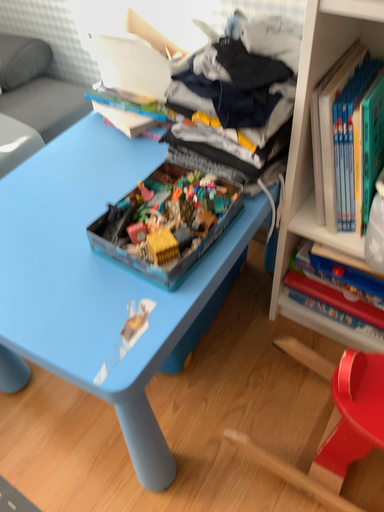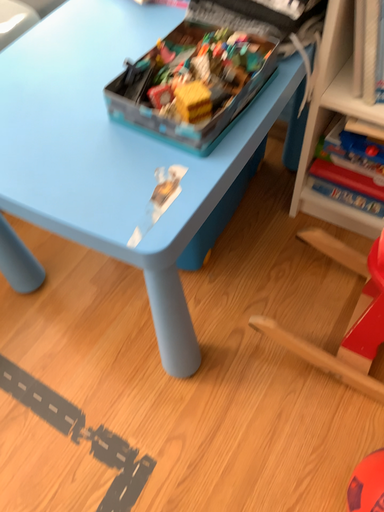
Question: How did the camera likely rotate when shooting the video?

Choices:
 (A) rotated upward
 (B) rotated downward

Answer: (B)